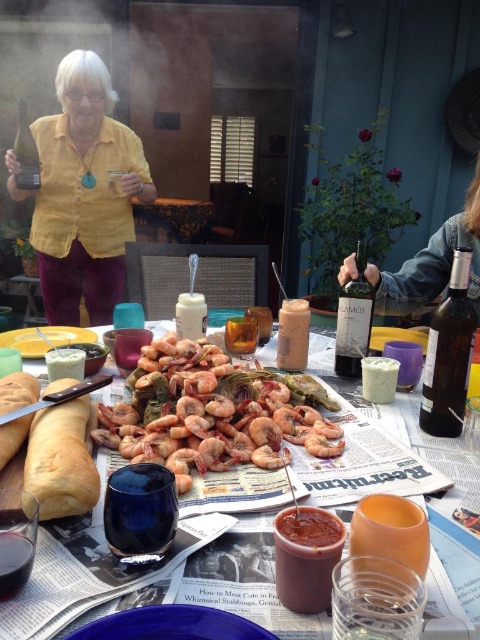
Question: Which of the following is the farthest from the observer?

Choices:
 (A) brown matte bread at lower left
 (B) wooden table at center

Answer: (B)

Question: Which object is positioned farthest from the brown matte bread at lower left?

Choices:
 (A) green glass bottle at upper left
 (B) dark glass bottle at right

Answer: (A)

Question: Which point is closer to the camera?

Choices:
 (A) (67, 404)
 (B) (361, 308)

Answer: (A)

Question: Does wooden table at center appear on the left side of white matte platter at center?

Choices:
 (A) yes
 (B) no

Answer: (A)

Question: Is dark glass bottle at right thinner than green glass bottle at upper left?

Choices:
 (A) yes
 (B) no

Answer: (A)

Question: Does denim jacket at right have a larger size compared to green glass bottle at upper left?

Choices:
 (A) no
 (B) yes

Answer: (B)